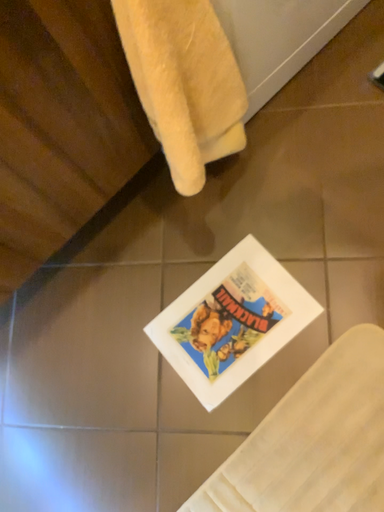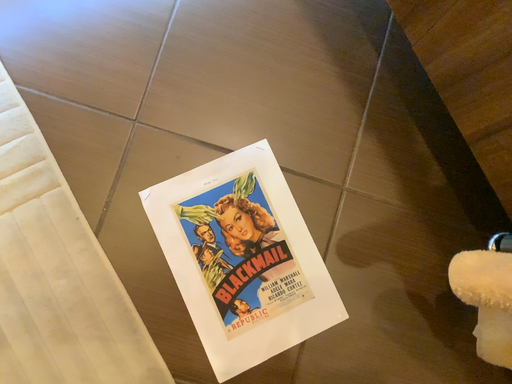
Question: How did the camera likely rotate when shooting the video?

Choices:
 (A) rotated right
 (B) rotated left

Answer: (B)